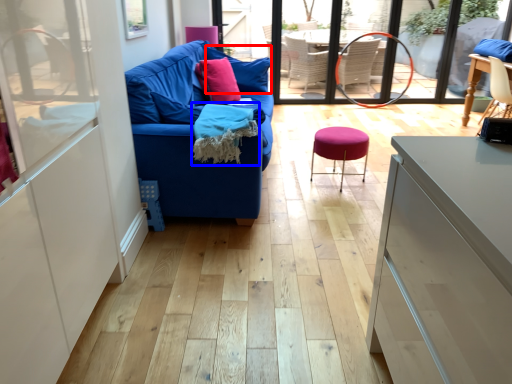
Question: Which object appears closest to the camera in this image, pillow (highlighted by a red box) or material (highlighted by a blue box)?

Choices:
 (A) pillow
 (B) material

Answer: (B)